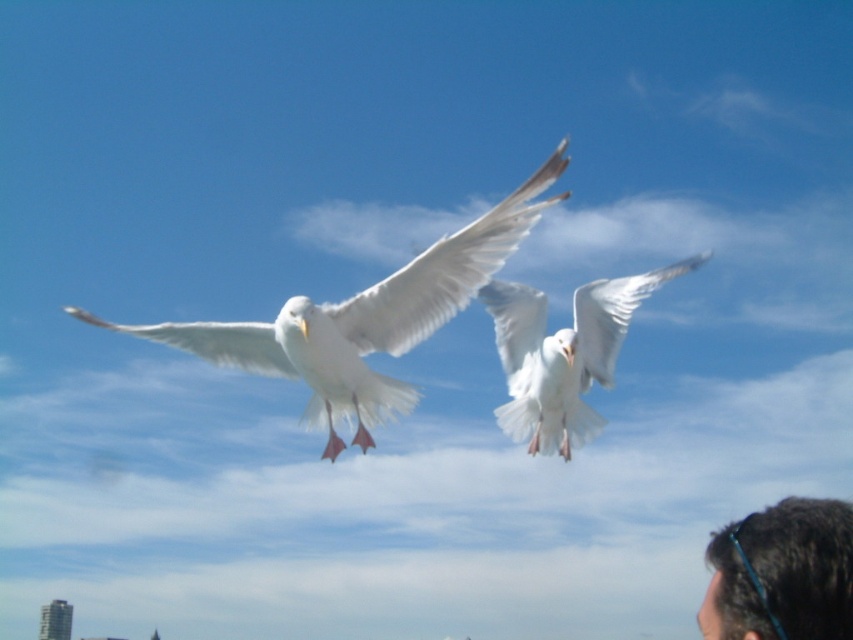
Question: Can you confirm if white feathered bird at upper center is wider than dark brown hair at lower right?

Choices:
 (A) yes
 (B) no

Answer: (A)

Question: Is white feathered bird at center positioned in front of white feathered bird at upper center?

Choices:
 (A) yes
 (B) no

Answer: (A)

Question: Which of the following is the closest to the observer?

Choices:
 (A) white feathered bird at center
 (B) white feathered bird at upper center
 (C) dark brown hair at lower right

Answer: (C)

Question: Which point appears closest to the camera in this image?

Choices:
 (A) (489, 216)
 (B) (680, 260)

Answer: (A)

Question: Can you confirm if white feathered bird at center is thinner than white feathered bird at upper center?

Choices:
 (A) yes
 (B) no

Answer: (B)

Question: Which point is closer to the camera?

Choices:
 (A) white feathered bird at center
 (B) dark brown hair at lower right
 (C) white feathered bird at upper center

Answer: (B)